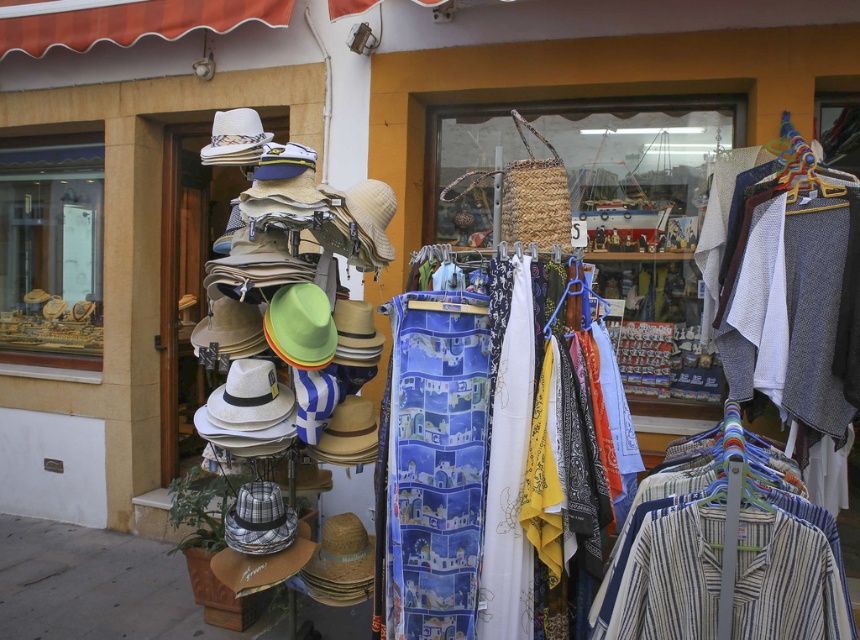
What do you see at coordinates (51, 252) in the screenshot? I see `gold metallic jewelry at upper left` at bounding box center [51, 252].

Between gold metallic jewelry at upper left and white straw cowboy hat at upper center, which one appears on the left side from the viewer's perspective?

gold metallic jewelry at upper left

Is point (22, 198) less distant than point (243, 120)?

No, (22, 198) is behind (243, 120).

You are a GUI agent. You are given a task and a screenshot of the screen. Output one action in this format:
    pyautogui.click(x=<x>, y=<y>)
    Task: Click on the gold metallic jewelry at upper left
    This screenshot has width=860, height=640.
    Given the screenshot: What is the action you would take?
    (x=51, y=252)

Can you confirm if woven straw bag at center is smaller than gold metallic jewelry at upper left?

Yes, woven straw bag at center is smaller than gold metallic jewelry at upper left.

Is woven straw bag at center further to camera compared to gold metallic jewelry at upper left?

No, woven straw bag at center is closer to the viewer.

Between point (507, 125) and point (0, 188), which one is positioned behind?

Point (0, 188)

Image resolution: width=860 pixels, height=640 pixels. What are the coordinates of `woven straw bag at center` in the screenshot? It's located at (636, 152).

Does point (238, 358) lie in front of point (229, 122)?

Yes, point (238, 358) is closer to viewer.

Looking at this image, which is more to the left, white straw cowboy hat at center or white straw cowboy hat at upper center?

From the viewer's perspective, white straw cowboy hat at upper center appears more on the left side.

You are a GUI agent. You are given a task and a screenshot of the screen. Output one action in this format:
    pyautogui.click(x=<x>, y=<y>)
    Task: Click on the white straw cowboy hat at center
    The width and height of the screenshot is (860, 640).
    Given the screenshot: What is the action you would take?
    pyautogui.click(x=249, y=397)

Image resolution: width=860 pixels, height=640 pixels. I want to click on white straw cowboy hat at center, so click(249, 397).